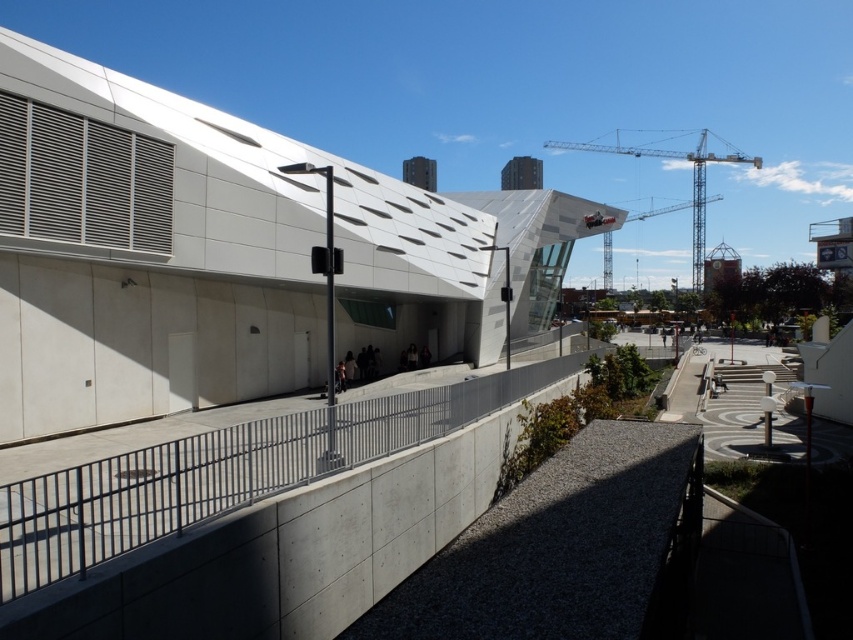
Question: Which object appears farthest from the camera in this image?

Choices:
 (A) gray metallic rail at center
 (B) metallic gray crane at upper right

Answer: (B)

Question: Does gray metallic rail at center appear on the right side of metallic gray crane at upper right?

Choices:
 (A) no
 (B) yes

Answer: (A)

Question: Which object is farther from the camera taking this photo?

Choices:
 (A) gray metallic rail at center
 (B) metallic gray crane at upper right

Answer: (B)

Question: Is gray metallic rail at center below metallic gray crane at upper right?

Choices:
 (A) no
 (B) yes

Answer: (B)

Question: Is gray metallic rail at center closer to the viewer compared to metallic gray crane at upper right?

Choices:
 (A) no
 (B) yes

Answer: (B)